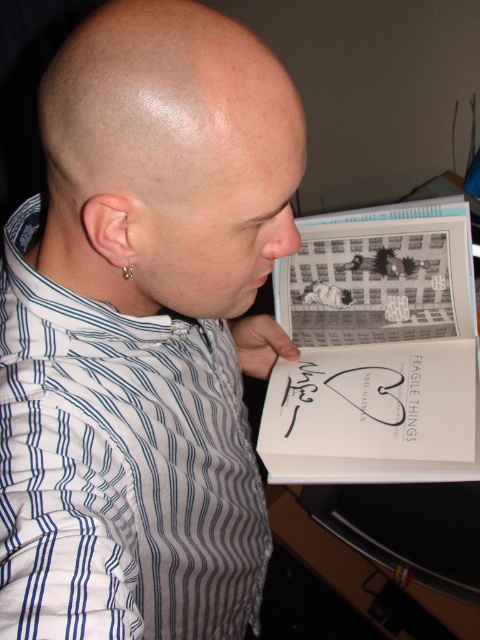
The image size is (480, 640). What do you see at coordinates (120, 467) in the screenshot?
I see `white striped shirt at center` at bounding box center [120, 467].

Is white striped shirt at center positioned before bald head at center?

Yes, it is.

Between point (259, 596) and point (72, 227), which one is positioned in front?

Point (72, 227) is more forward.

Locate an element on the screen. white striped shirt at center is located at coordinates (120, 467).

Is bald head at center above silver metallic earring at ear?

Yes, bald head at center is above silver metallic earring at ear.

Does bald head at center have a greater height compared to silver metallic earring at ear?

Indeed, bald head at center has a greater height compared to silver metallic earring at ear.

Is point (134, 166) less distant than point (131, 268)?

Yes.

At what (x,y) coordinates should I click in order to perform the action: click on bald head at center. Please return your answer as a coordinate pair (x, y). The height and width of the screenshot is (640, 480). Looking at the image, I should click on pos(168,161).

Does white striped shirt at center have a smaller size compared to silver metallic earring at ear?

Actually, white striped shirt at center might be larger than silver metallic earring at ear.

Does white striped shirt at center appear on the right side of silver metallic earring at ear?

Correct, you'll find white striped shirt at center to the right of silver metallic earring at ear.

Is point (232, 419) farther from camera compared to point (126, 266)?

Yes, point (232, 419) is behind point (126, 266).

Find the location of a particular element. white striped shirt at center is located at coordinates (120, 467).